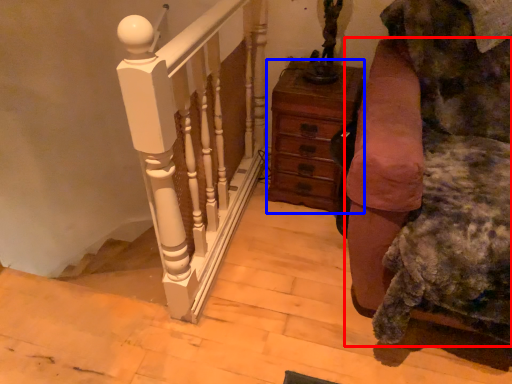
Question: Which object is closer to the camera taking this photo, furniture (highlighted by a red box) or chest of drawers (highlighted by a blue box)?

Choices:
 (A) furniture
 (B) chest of drawers

Answer: (A)